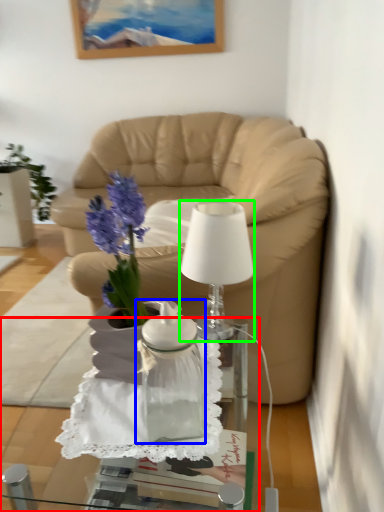
Question: Considering the real-world distances, which object is farthest from desk (highlighted by a red box)? vase (highlighted by a blue box) or lamp (highlighted by a green box)?

Choices:
 (A) vase
 (B) lamp

Answer: (B)